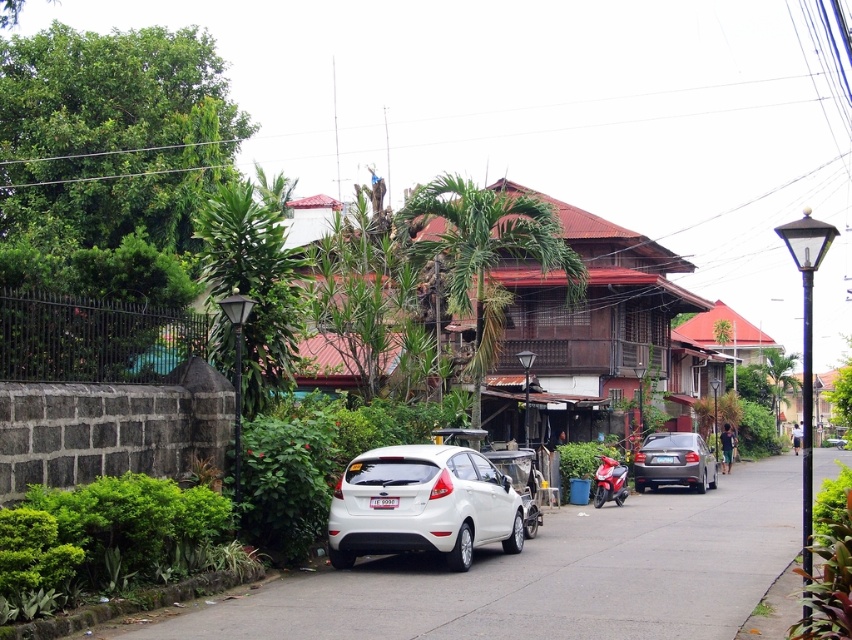
You are standing at the point with coordinates point [390,448] and want to walk towards the house with the red roof. Which direction should you go relative to point [689,477]?

You should walk towards point [390,448] because it is in front of point [689,477], so the house with the red roof is likely in that direction.

You are a delivery driver who needs to park your vehicle in this residential area. There is a white matte hatchback at center. Based on its position, can you estimate how far it is from the curb?

The white matte hatchback at center is positioned at coordinates point (422,504), which indicates it is parked approximately 0.5 meters away from the curb.